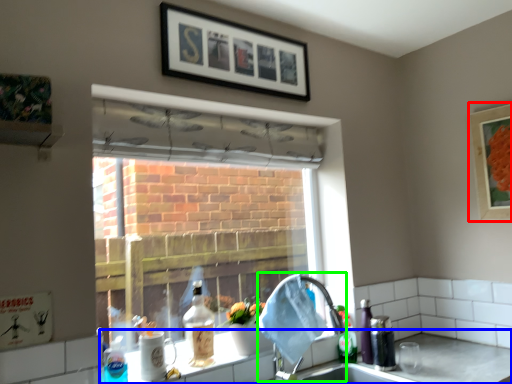
Question: Based on their relative distances, which object is farther from picture frame (highlighted by a red box)? Choose from counter top (highlighted by a blue box) and faucet (highlighted by a green box).

Choices:
 (A) counter top
 (B) faucet

Answer: (B)